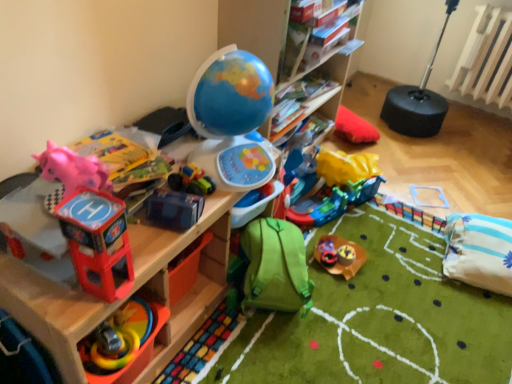
The width and height of the screenshot is (512, 384). I want to click on vacant area that lies between blue plastic toy at center, which ranks as the sixth toy in right-to-left order, and red plastic helicopter at left, acting as the third toy starting from the left, so click(x=149, y=250).